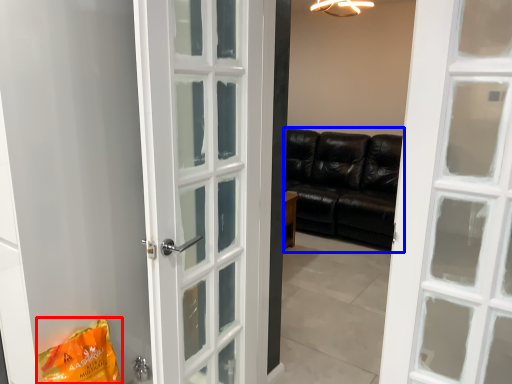
Question: Among these objects, which one is farthest to the camera, shopping bag (highlighted by a red box) or studio couch (highlighted by a blue box)?

Choices:
 (A) shopping bag
 (B) studio couch

Answer: (B)